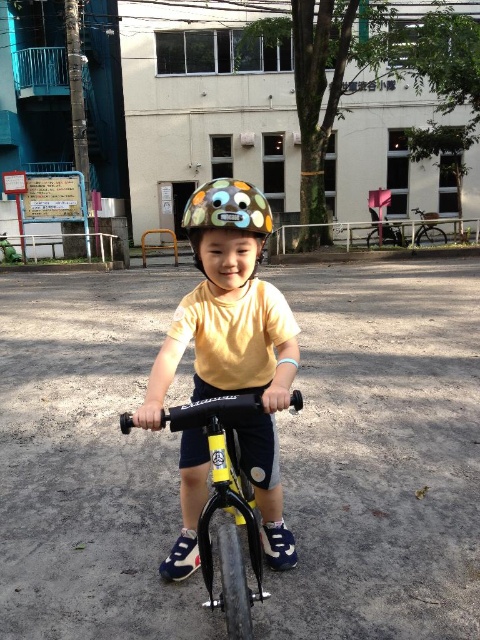
The child is wearing a helmet and riding a bicycle. Based on the scene, can you determine if the matte colorful helmet at center is located above the metallic silver bicycle at right?

Yes, the matte colorful helmet at center is above the metallic silver bicycle at right according to the description.

You are a safety inspector checking the setup of the child riding the black matte bicycle at center. The yellow matte helmet at center is currently placed over the bicycle. Is this placement correct according to safety guidelines?

The yellow matte helmet at center is positioned over the black matte bicycle at center, which means it is not properly worn by the child. According to safety guidelines, helmets must be worn on the head, so the placement is incorrect.

From the picture: You are a safety inspector checking the placement of the yellow matte helmet at center. According to safety regulations, the helmet must be positioned within the central safety zone defined by coordinates between 0.4 and 0.6 on both the x and y axes. Is the helmet within the required zone?

The yellow matte helmet at center is located at point (235, 339), which falls within the central safety zone between 0.4 and 0.6 on both axes. Therefore, the helmet is properly positioned according to the regulations.